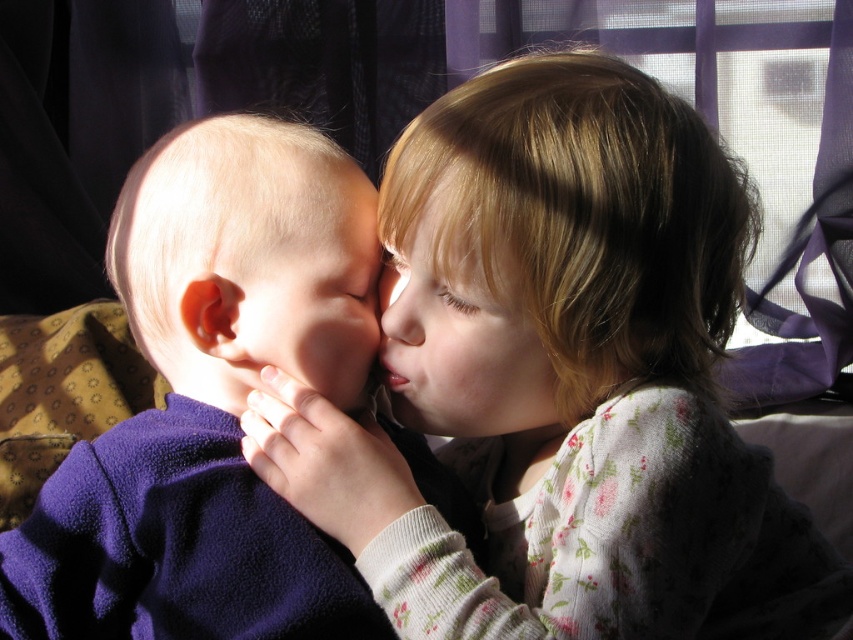
You are a parent looking for your child who is wearing a fluffy pink sweater at center. Based on the scene description, where should you look to find the child?

The fluffy pink sweater at center is located at point (x=561, y=380), so you should look there to find the child wearing it.

You are a photographer trying to capture the children in the scene. You want to ensure that the blonde hair at upper right and the smooth skin face at center are both visible in the frame. Based on their positions, which object should you focus on first to ensure both are in the shot?

The blonde hair at upper right is below the smooth skin face at center, so you should focus on the smooth skin face at center first to ensure both are in the frame.

You are standing in the scene and want to reach the point at coordinates (x=489, y=323). If your arm is 22 inches long, can you reach it without moving your feet?

The point at coordinates (x=489, y=323) is 23.39 inches away from you. Since your arm is only 22 inches long, you cannot reach it without moving your feet.